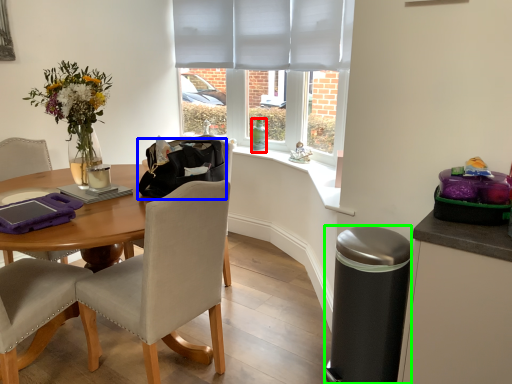
Question: Based on their relative distances, which object is nearer to bottle (highlighted by a red box)? Choose from handbag (highlighted by a blue box) and trash bin/can (highlighted by a green box).

Choices:
 (A) handbag
 (B) trash bin/can

Answer: (A)